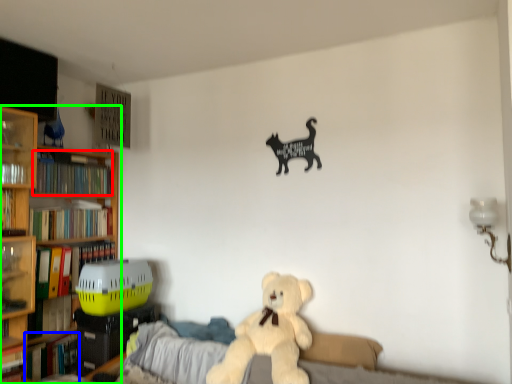
Question: Estimate the real-world distances between objects in this image. Which object is farther from book (highlighted by a red box), book (highlighted by a blue box) or bookcase (highlighted by a green box)?

Choices:
 (A) book
 (B) bookcase

Answer: (A)